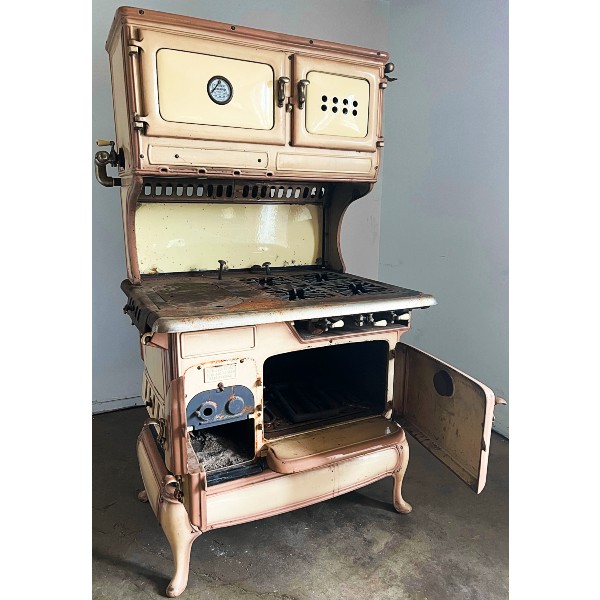
Where is `floor`? This screenshot has height=600, width=600. floor is located at coordinates (334, 573).